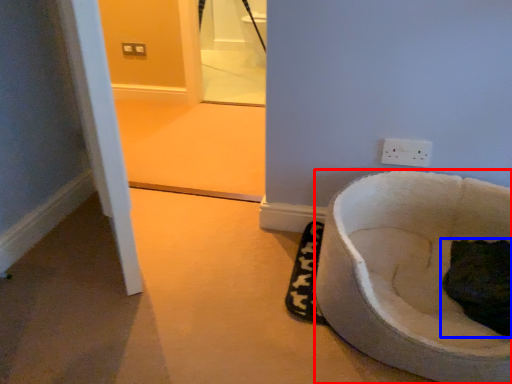
Question: Which point is further to the camera, toilet (highlighted by a red box) or cat (highlighted by a blue box)?

Choices:
 (A) toilet
 (B) cat

Answer: (B)